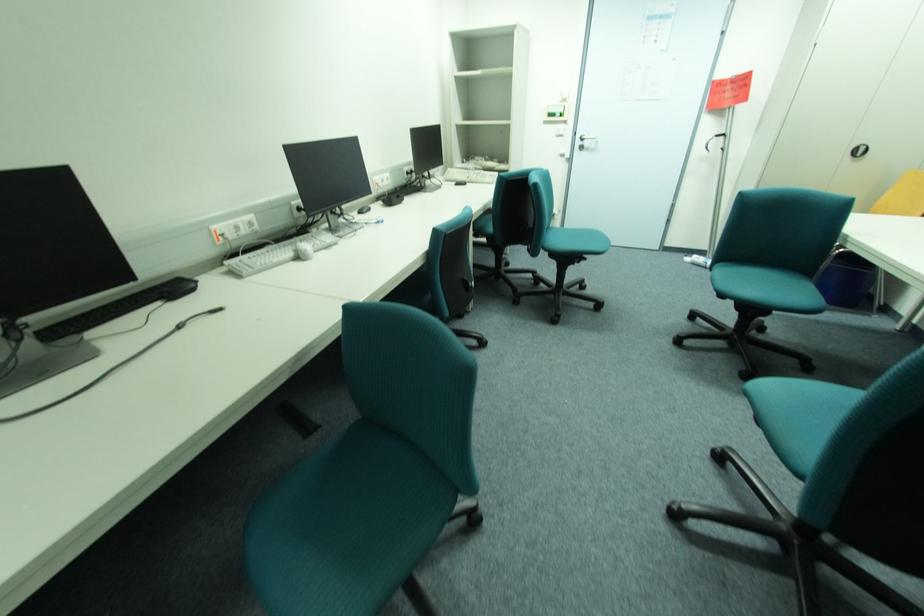
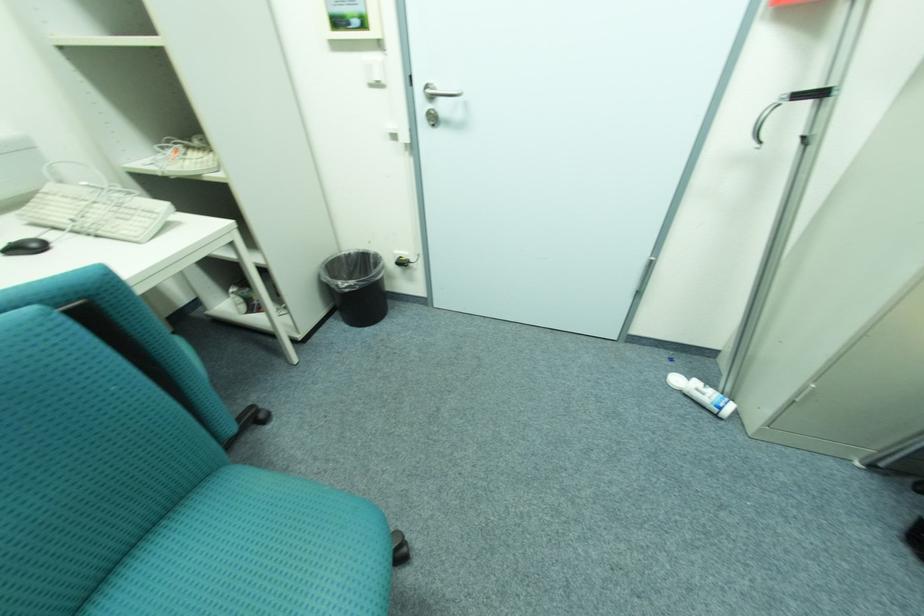
Locate, in the second image, the point that corresponds to [695,259] in the first image.

(683, 381)